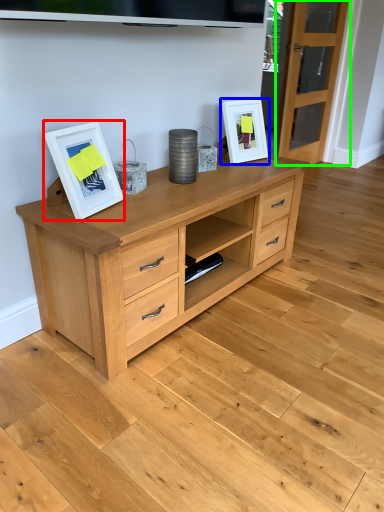
Question: Estimate the real-world distances between objects in this image. Which object is closer to picture frame (highlighted by a red box), picture frame (highlighted by a blue box) or glass door (highlighted by a green box)?

Choices:
 (A) picture frame
 (B) glass door

Answer: (A)